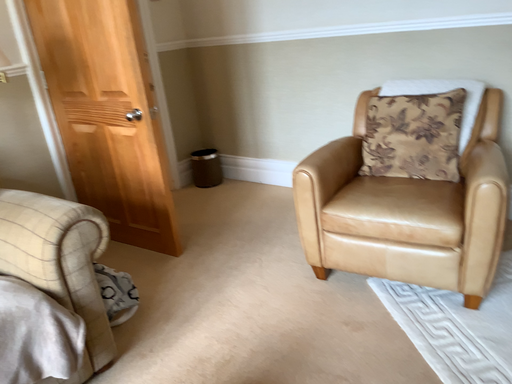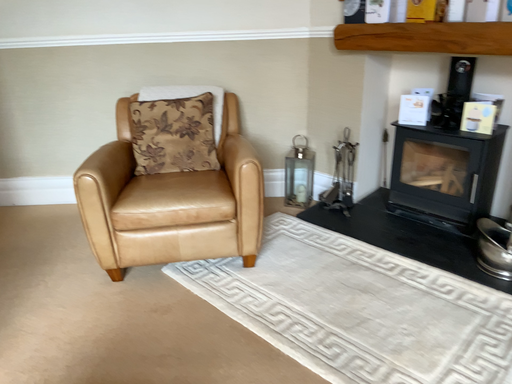
Question: Which way did the camera rotate in the video?

Choices:
 (A) rotated left
 (B) rotated right

Answer: (B)